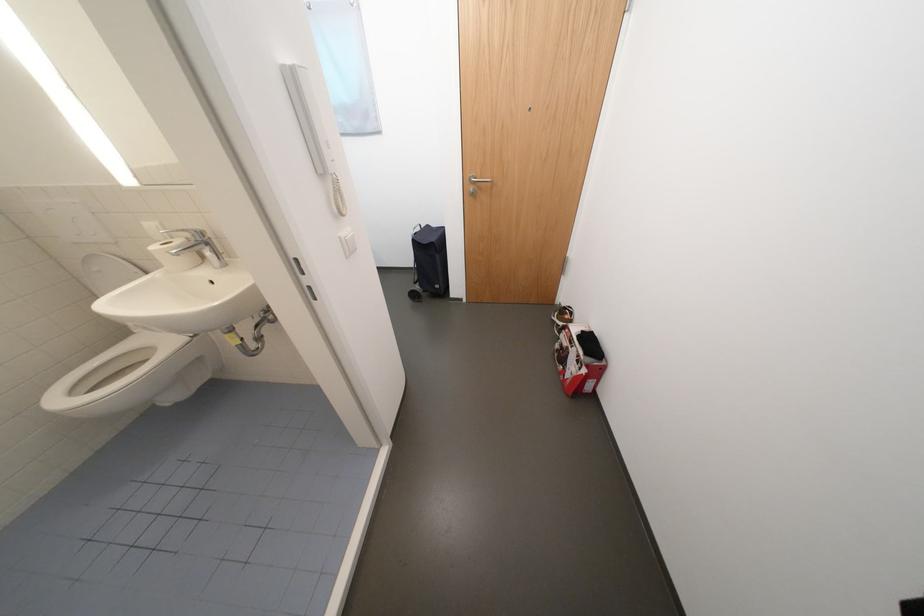
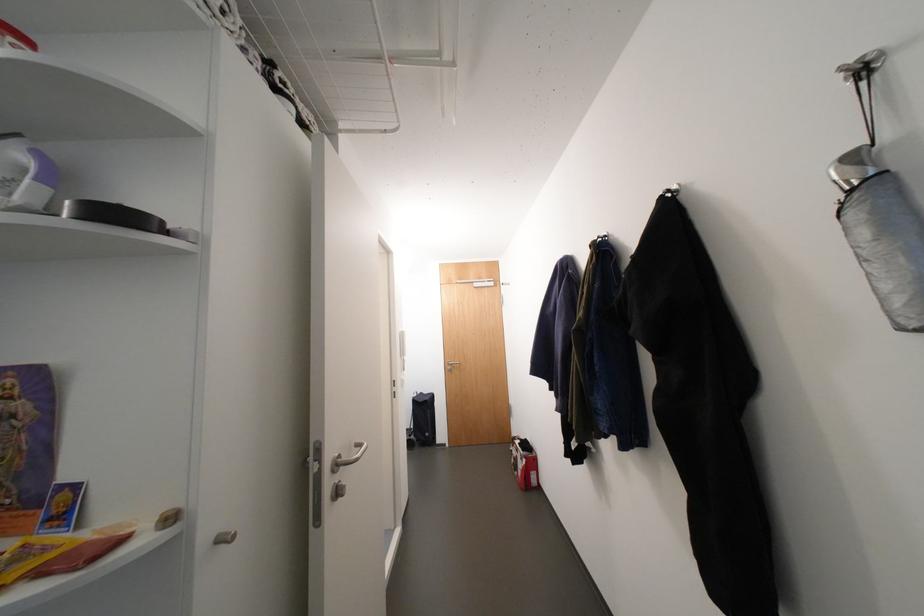
Locate, in the second image, the point that corresponds to (x=576, y=377) in the first image.

(527, 474)